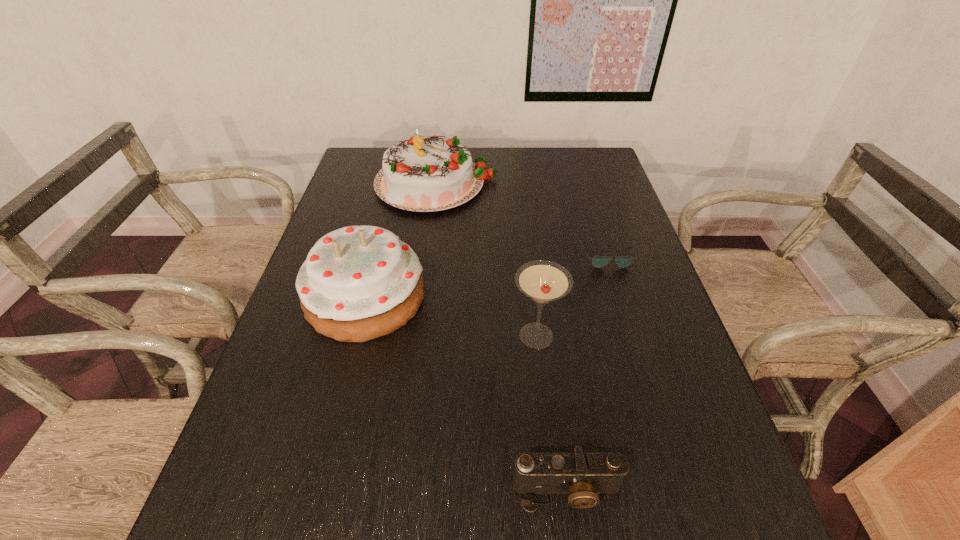
Locate an element on the screen. The width and height of the screenshot is (960, 540). free space that is in between the martini and the shortest object is located at coordinates (572, 296).

Locate an element on the screen. empty space between the nearer cake and the martini is located at coordinates (451, 316).

Find the location of `vacant space in between the farther cake and the nearest object`. vacant space in between the farther cake and the nearest object is located at coordinates 502,337.

The image size is (960, 540). Identify the location of blank region between the nearest object and the farther cake. (502, 337).

Find the location of a particular element. free spot between the shortest object and the fourth tallest object is located at coordinates (588, 374).

Image resolution: width=960 pixels, height=540 pixels. I want to click on vacant region between the second shortest object and the sunglasses, so click(588, 374).

Identify the location of vacant space that's between the rightmost object and the martini. The width and height of the screenshot is (960, 540). (572, 296).

Identify the location of free spot between the shortest object and the martini. Image resolution: width=960 pixels, height=540 pixels. (572, 296).

Find the location of a particular element. The image size is (960, 540). vacant point located between the nearest object and the rightmost object is located at coordinates (588, 374).

What are the coordinates of `object identified as the fourth closest to the farther cake` in the screenshot? It's located at (582, 475).